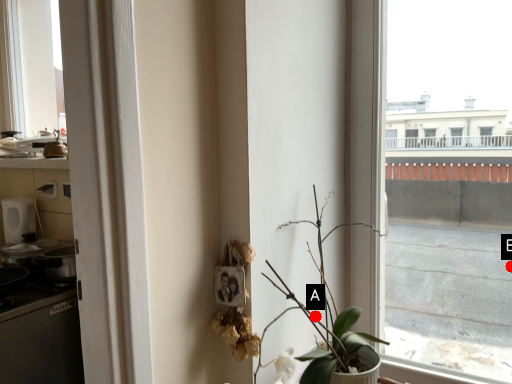
Question: Two points are circled on the image, labeled by A and B beside each circle. Among these points, which one is nearest to the camera?

Choices:
 (A) A is closer
 (B) B is closer

Answer: (A)